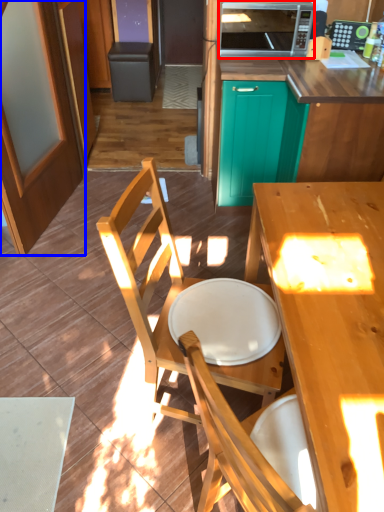
Question: Which of the following is the closest to the observer, microwave oven (highlighted by a red box) or screen door (highlighted by a blue box)?

Choices:
 (A) microwave oven
 (B) screen door

Answer: (B)